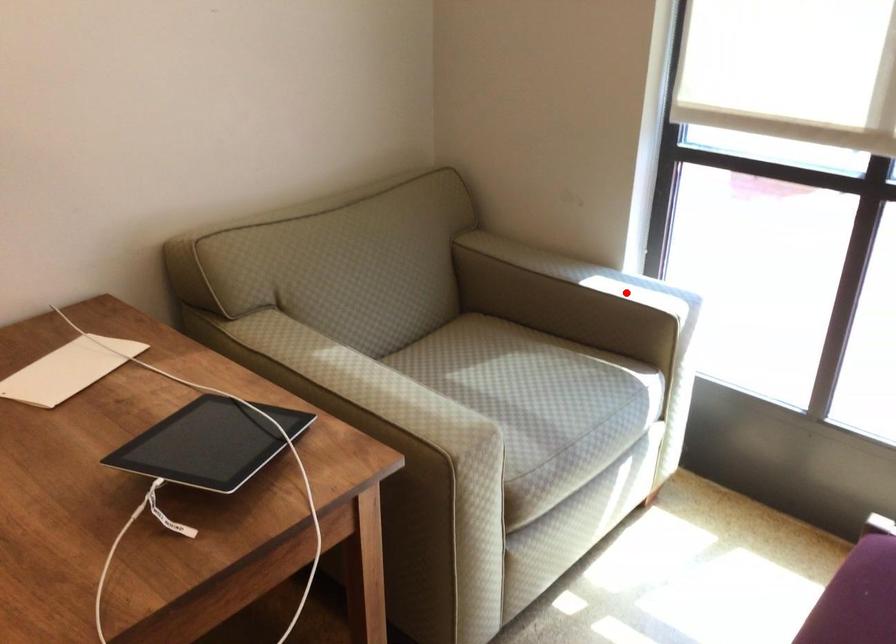
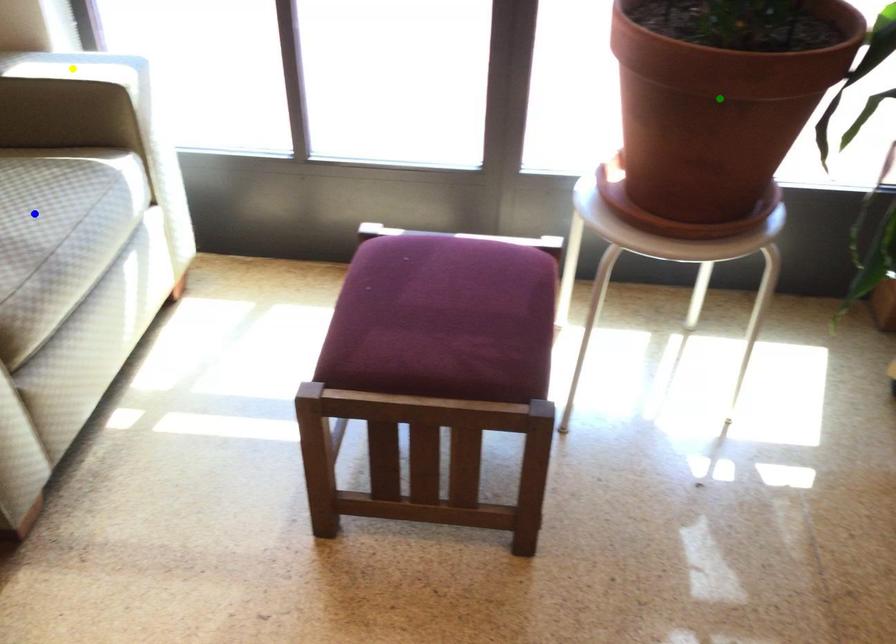
Question: I am providing you with two images of the same scene from different viewpoints. A red point is marked on the first image. You are given multiple points on the second image. In image 2, which mark is for the same physical point as the one in image 1?

Choices:
 (A) blue point
 (B) green point
 (C) yellow point

Answer: (C)